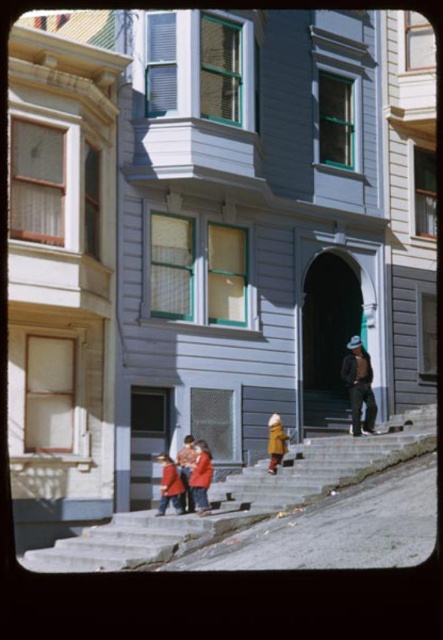
Question: Estimate the real-world distances between objects in this image. Which object is farther from the concrete stairs at center?

Choices:
 (A) dark brown leather jacket at center
 (B) red wool coat at center
 (C) yellow wool coat at center

Answer: (A)

Question: Is concrete stairs at center thinner than dark brown leather jacket at center?

Choices:
 (A) yes
 (B) no

Answer: (B)

Question: Based on their relative distances, which object is farther from the dark brown leather jacket at center?

Choices:
 (A) red wool coat at center
 (B) red wool coat at lower center

Answer: (B)

Question: Is concrete stairs at center positioned at the back of dark brown leather jacket at center?

Choices:
 (A) yes
 (B) no

Answer: (B)

Question: Is dark brown leather jacket at center above red wool coat at center?

Choices:
 (A) no
 (B) yes

Answer: (B)

Question: Estimate the real-world distances between objects in this image. Which object is closer to the dark brown leather jacket at center?

Choices:
 (A) red wool coat at center
 (B) red wool coat at lower center
 (C) yellow wool coat at center

Answer: (C)